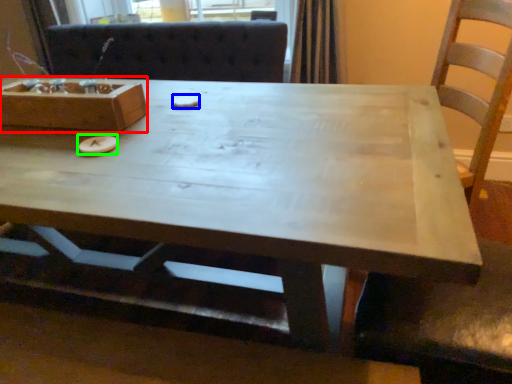
Question: Considering the real-world distances, which object is closest to box (highlighted by a red box)? food (highlighted by a blue box) or food (highlighted by a green box).

Choices:
 (A) food
 (B) food

Answer: (B)